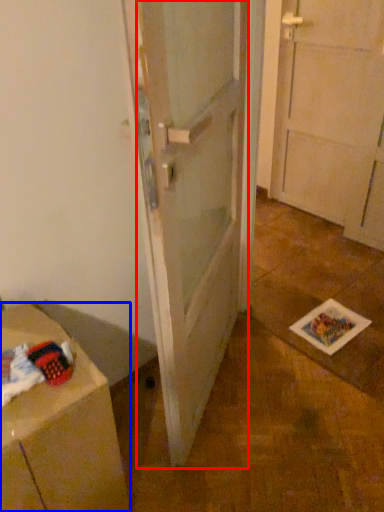
Question: Which of the following is the farthest to the observer, door (highlighted by a red box) or cabinetry (highlighted by a blue box)?

Choices:
 (A) door
 (B) cabinetry

Answer: (B)